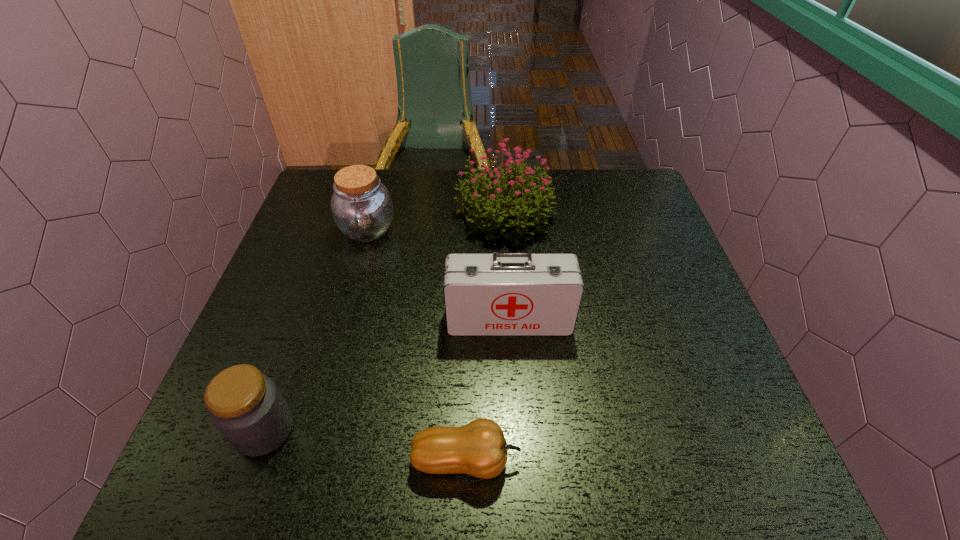
I want to click on vacant space at the near right corner of the desktop, so click(x=708, y=463).

Where is `empty space between the bouquet and the nearer jar`? The height and width of the screenshot is (540, 960). empty space between the bouquet and the nearer jar is located at coordinates (385, 322).

I want to click on free spot between the first-aid kit and the gourd, so click(x=488, y=390).

This screenshot has width=960, height=540. Find the location of `free spot between the nearer jar and the farther jar`. free spot between the nearer jar and the farther jar is located at coordinates (316, 330).

Image resolution: width=960 pixels, height=540 pixels. In order to click on vacant space that is in between the tallest object and the farther jar in this screenshot , I will do `click(436, 222)`.

Identify the location of vacant area that lies between the farther jar and the gourd. Image resolution: width=960 pixels, height=540 pixels. (417, 345).

The width and height of the screenshot is (960, 540). Find the location of `vacant area that lies between the nearer jar and the bouquet`. vacant area that lies between the nearer jar and the bouquet is located at coordinates (385, 322).

Image resolution: width=960 pixels, height=540 pixels. What are the coordinates of `vacant space that is in between the gourd and the bouquet` in the screenshot? It's located at (486, 337).

Where is `vacant space that's between the first-aid kit and the nearer jar`? vacant space that's between the first-aid kit and the nearer jar is located at coordinates (387, 375).

At what (x,y) coordinates should I click in order to perform the action: click on vacant space in between the farther jar and the third farthest object. Please return your answer as a coordinate pair (x, y). Looking at the image, I should click on (439, 275).